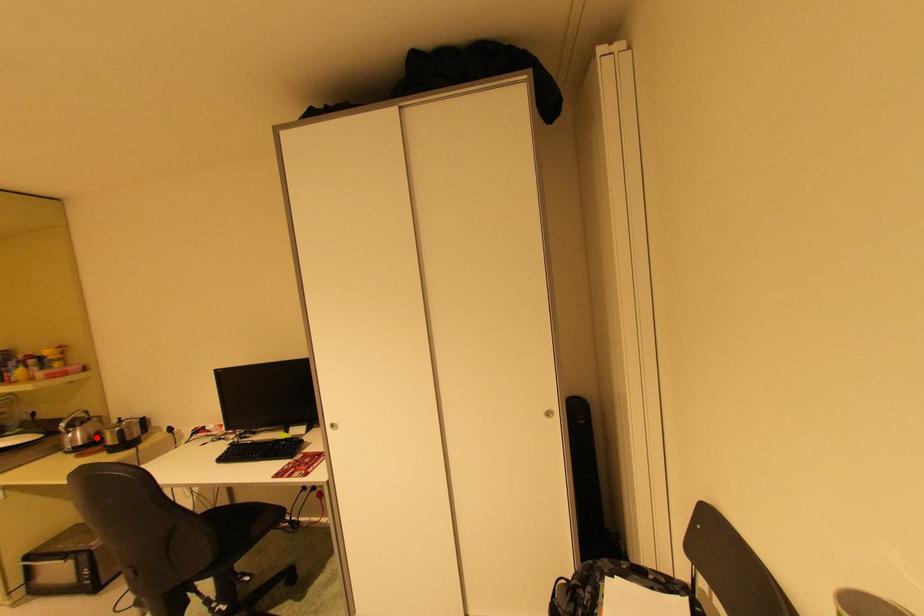
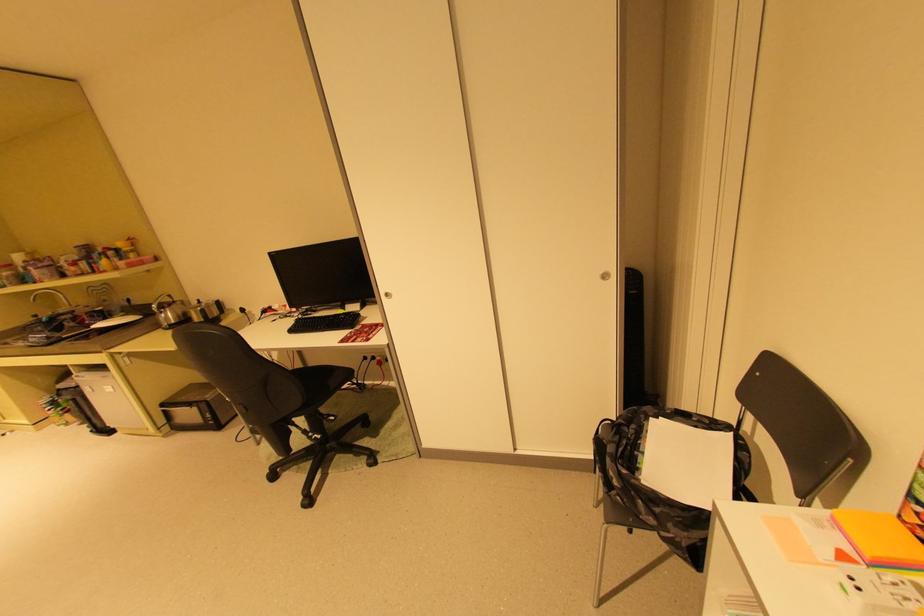
Question: I am providing you with two images of the same scene from different viewpoints. Image1 has a red point marked. In image2, the corresponding 3D location appears at what relative position? Reply with the corresponding letter.

Choices:
 (A) Closer
 (B) Farther

Answer: (B)